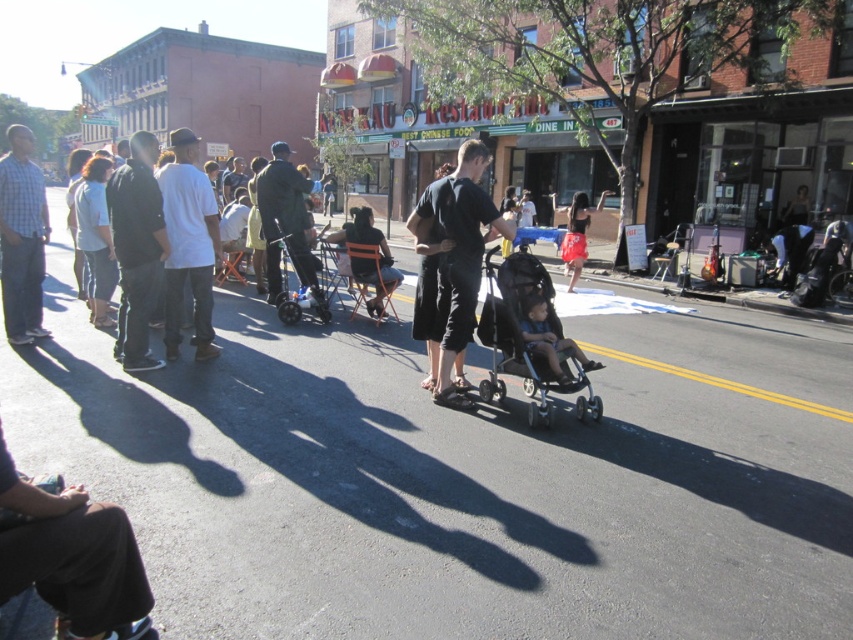
Is black textured stroller at center positioned behind dark gray pants at center?

No, black textured stroller at center is in front of dark gray pants at center.

Does point (584, 396) lie in front of point (238, 186)?

Yes, point (584, 396) is closer to viewer.

Find the location of a particular element. The height and width of the screenshot is (640, 853). black textured stroller at center is located at coordinates (526, 340).

Between black matte stroller at center and green matte jacket at center, which one has more height?

green matte jacket at center is taller.

Who is more forward, (x=447, y=307) or (x=289, y=172)?

Point (x=447, y=307) is in front.

This screenshot has width=853, height=640. What are the coordinates of `black matte stroller at center` in the screenshot? It's located at (457, 259).

Describe the element at coordinates (189, 244) in the screenshot. I see `white matte shirt at center` at that location.

Locate an element on the screen. white matte shirt at center is located at coordinates (189, 244).